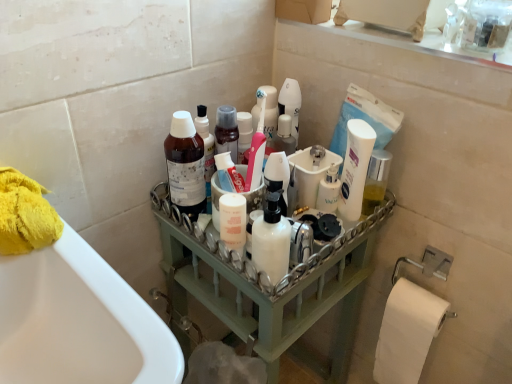
Question: Is the position of green wood tray at center less distant than that of white matte pump bottle at center, the second cleaning product viewed from the back?

Choices:
 (A) yes
 (B) no

Answer: (B)

Question: Can white matte pump bottle at center, the second cleaning product viewed from the back, be found inside green wood tray at center?

Choices:
 (A) yes
 (B) no

Answer: (B)

Question: From a real-world perspective, is green wood tray at center physically above white matte pump bottle at center, the first cleaning product when ordered from right to left?

Choices:
 (A) yes
 (B) no

Answer: (B)

Question: Can you confirm if green wood tray at center is smaller than white matte pump bottle at center, the first cleaning product when ordered from right to left?

Choices:
 (A) yes
 (B) no

Answer: (B)

Question: Is white matte pump bottle at center, the second cleaning product when ordered from left to right, at the back of green wood tray at center?

Choices:
 (A) yes
 (B) no

Answer: (B)

Question: From the image's perspective, is green wood tray at center below white matte pump bottle at center, the second cleaning product viewed from the back?

Choices:
 (A) no
 (B) yes

Answer: (B)

Question: Is white glossy pump bottle at center far away from white glossy mouthwash at center?

Choices:
 (A) yes
 (B) no

Answer: (B)

Question: Can we say white glossy pump bottle at center lies outside white glossy mouthwash at center?

Choices:
 (A) no
 (B) yes

Answer: (B)

Question: Can you confirm if white glossy pump bottle at center is bigger than white glossy mouthwash at center?

Choices:
 (A) yes
 (B) no

Answer: (B)

Question: Could you tell me if white glossy pump bottle at center is turned towards white glossy mouthwash at center?

Choices:
 (A) no
 (B) yes

Answer: (A)

Question: Does white glossy pump bottle at center come behind white glossy mouthwash at center?

Choices:
 (A) yes
 (B) no

Answer: (A)

Question: Is white glossy pump bottle at center at the right side of white glossy mouthwash at center?

Choices:
 (A) no
 (B) yes

Answer: (A)

Question: Can you confirm if white matte pump bottle at center, placed as the first cleaning product when sorted from front to back, is positioned to the left of white glossy mouthwash at center?

Choices:
 (A) yes
 (B) no

Answer: (A)